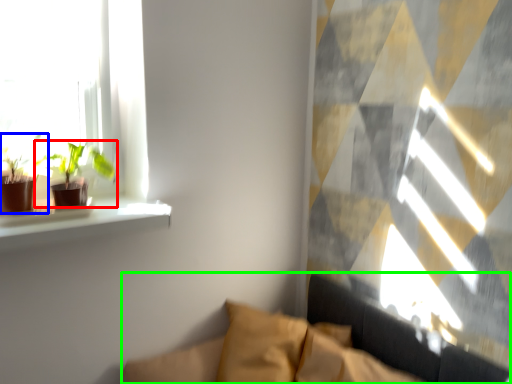
Question: Estimate the real-world distances between objects in this image. Which object is closer to houseplant (highlighted by a red box), houseplant (highlighted by a blue box) or couch (highlighted by a green box)?

Choices:
 (A) houseplant
 (B) couch

Answer: (A)